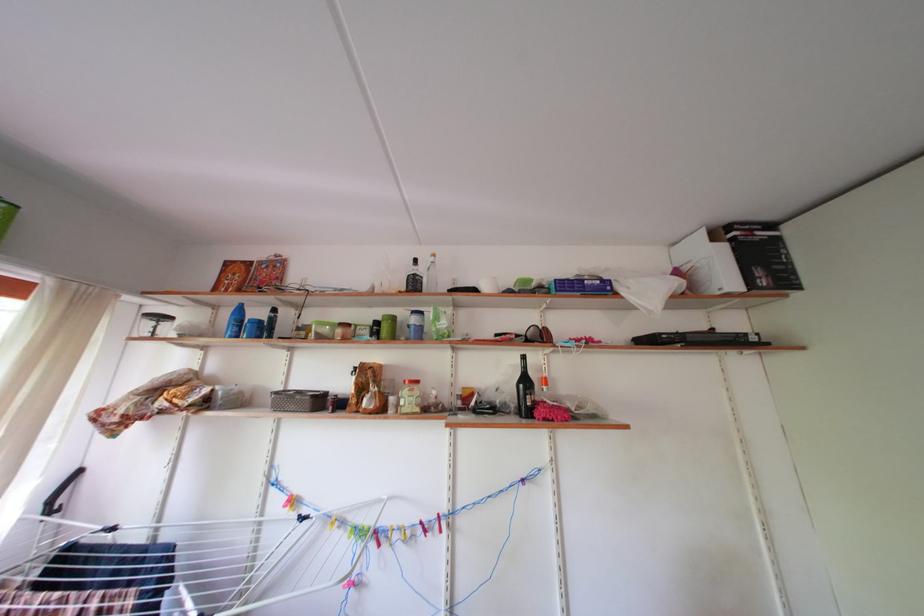
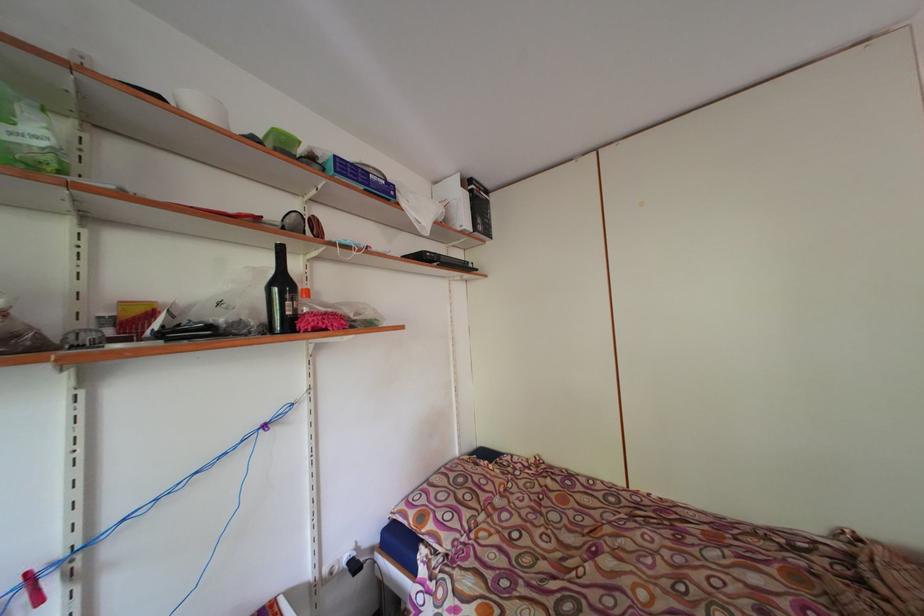
Question: The images are taken continuously from a first-person perspective. In which direction is your viewpoint rotating?

Choices:
 (A) Left
 (B) Right
 (C) Up
 (D) Down

Answer: (B)